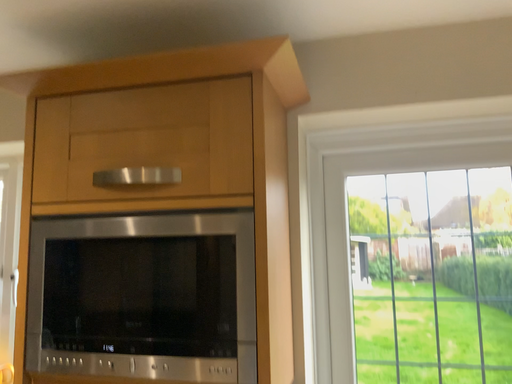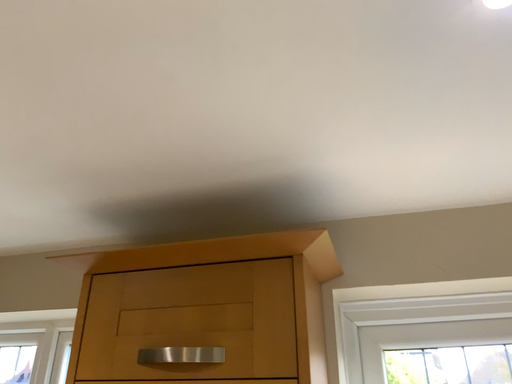
Question: How did the camera likely rotate when shooting the video?

Choices:
 (A) rotated upward
 (B) rotated downward

Answer: (A)